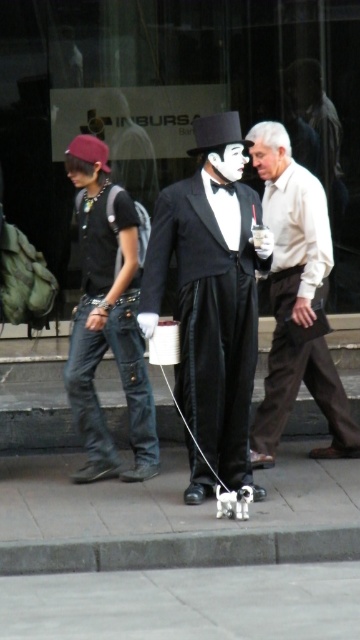
Can you confirm if matte black tuxedo at center is taller than black satin bow tie at center?

Yes.

Is matte black tuxedo at center to the left of black satin bow tie at center from the viewer's perspective?

Yes, matte black tuxedo at center is to the left of black satin bow tie at center.

Which is in front, point (206, 340) or point (222, 182)?

Point (206, 340) is in front.

This screenshot has height=640, width=360. Find the location of `matte black tuxedo at center`. matte black tuxedo at center is located at coordinates (212, 292).

Is matte white shirt at center shorter than black satin bow tie at center?

No, matte white shirt at center is not shorter than black satin bow tie at center.

Can you confirm if matte white shirt at center is bigger than black satin bow tie at center?

Yes, matte white shirt at center is bigger than black satin bow tie at center.

Which is in front, point (326, 253) or point (218, 188)?

Point (218, 188)

Identify the location of matte white shirt at center. (295, 300).

Between matte black tuxedo at center and matte white shirt at center, which one is positioned lower?

matte black tuxedo at center is below.

Does matte black tuxedo at center appear on the right side of matte white shirt at center?

In fact, matte black tuxedo at center is to the left of matte white shirt at center.

From the picture: Who is more distant from viewer, (189, 225) or (312, 234)?

The point (312, 234) is behind.

In order to click on matte black tuxedo at center in this screenshot , I will do `click(212, 292)`.